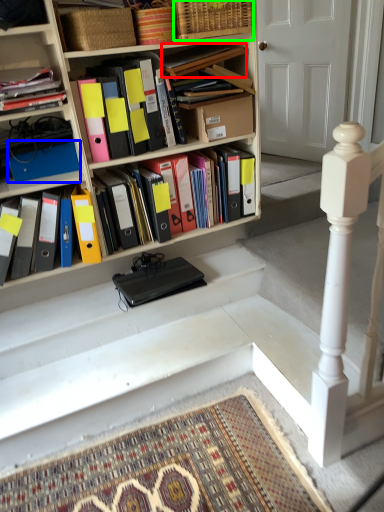
Question: Considering the real-world distances, which object is closest to book (highlighted by a red box)? paperback book (highlighted by a blue box) or basket (highlighted by a green box).

Choices:
 (A) paperback book
 (B) basket

Answer: (B)